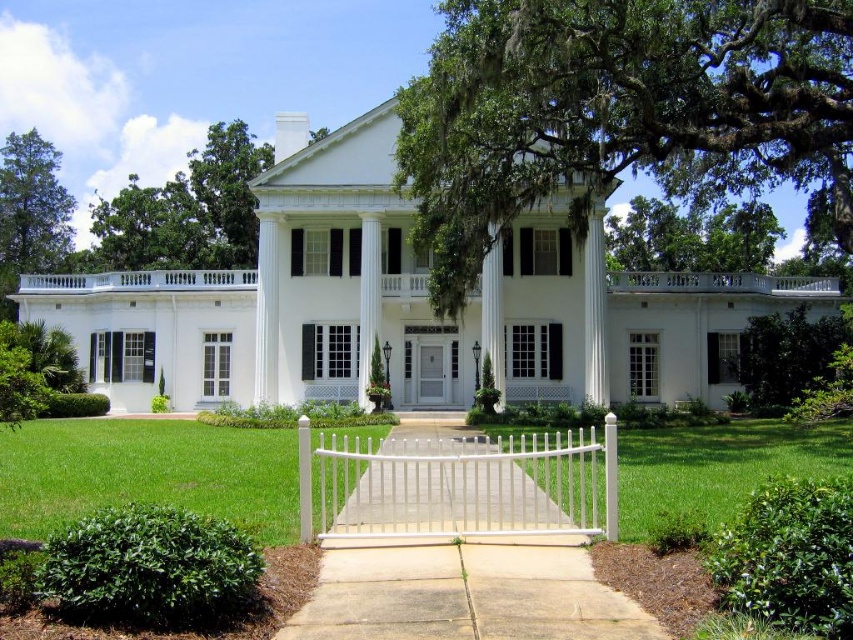
Question: Which object appears closest to the camera in this image?

Choices:
 (A) white glossy column at center
 (B) white vinyl gate at center
 (C) green grass at center

Answer: (C)

Question: Can you confirm if green grass at center is positioned below white vinyl gate at center?

Choices:
 (A) yes
 (B) no

Answer: (A)

Question: Which object is closer to the camera taking this photo?

Choices:
 (A) white vinyl gate at center
 (B) green grass at center

Answer: (B)

Question: Observing the image, what is the correct spatial positioning of green grass at center in reference to white glossy column at center?

Choices:
 (A) left
 (B) right

Answer: (B)

Question: Is white vinyl gate at center to the right of white glossy column at center from the viewer's perspective?

Choices:
 (A) no
 (B) yes

Answer: (B)

Question: Which point is farther to the camera?

Choices:
 (A) (750, 472)
 (B) (358, 353)

Answer: (B)